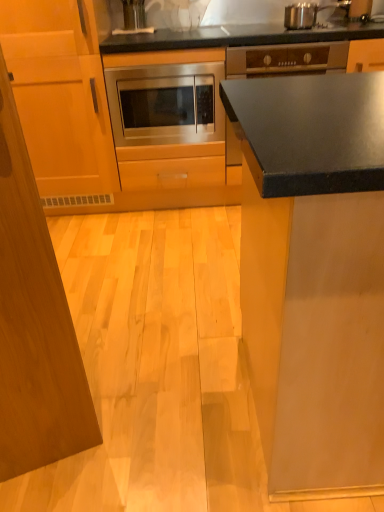
Question: From a real-world perspective, is stainless steel microwave at center positioned under wooden cabinet at left, which is the 2th cabinetry from right to left, based on gravity?

Choices:
 (A) no
 (B) yes

Answer: (A)

Question: Does stainless steel microwave at center come behind wooden cabinet at left, which is the 2th cabinetry from right to left?

Choices:
 (A) no
 (B) yes

Answer: (B)

Question: Considering the relative sizes of stainless steel microwave at center and wooden cabinet at left, which is counted as the 1th cabinetry, starting from the left, in the image provided, is stainless steel microwave at center wider than wooden cabinet at left, which is counted as the 1th cabinetry, starting from the left,?

Choices:
 (A) yes
 (B) no

Answer: (B)

Question: From the image's perspective, is stainless steel microwave at center located beneath wooden cabinet at left, which is counted as the 1th cabinetry, starting from the left?

Choices:
 (A) yes
 (B) no

Answer: (B)

Question: Is stainless steel microwave at center positioned with its back to wooden cabinet at left, which is counted as the 1th cabinetry, starting from the left?

Choices:
 (A) no
 (B) yes

Answer: (A)

Question: Can you confirm if stainless steel microwave at center is positioned to the left of wooden cabinet at left, which is the 2th cabinetry from right to left?

Choices:
 (A) yes
 (B) no

Answer: (B)

Question: From a real-world perspective, is stainless steel microwave at center, which is the 2th cabinetry from left to right, positioned over matte black countertop at upper right based on gravity?

Choices:
 (A) yes
 (B) no

Answer: (B)

Question: Is there a large distance between stainless steel microwave at center, which is the 2th cabinetry from left to right, and matte black countertop at upper right?

Choices:
 (A) yes
 (B) no

Answer: (A)

Question: Considering the relative positions of stainless steel microwave at center, which is the 2th cabinetry from left to right, and matte black countertop at upper right in the image provided, is stainless steel microwave at center, which is the 2th cabinetry from left to right, to the left of matte black countertop at upper right from the viewer's perspective?

Choices:
 (A) no
 (B) yes

Answer: (B)

Question: Is stainless steel microwave at center, the 1th cabinetry positioned from the right, smaller than matte black countertop at upper right?

Choices:
 (A) no
 (B) yes

Answer: (A)

Question: Is stainless steel microwave at center, which is the 2th cabinetry from left to right, in front of matte black countertop at upper right?

Choices:
 (A) yes
 (B) no

Answer: (A)

Question: Is stainless steel microwave at center, which is the 2th cabinetry from left to right, positioned beyond the bounds of matte black countertop at upper right?

Choices:
 (A) no
 (B) yes

Answer: (B)

Question: From a real-world perspective, is stainless steel microwave at center, which is the 2th cabinetry from left to right, below wooden cabinet at left, which is counted as the 1th cabinetry, starting from the left?

Choices:
 (A) yes
 (B) no

Answer: (A)